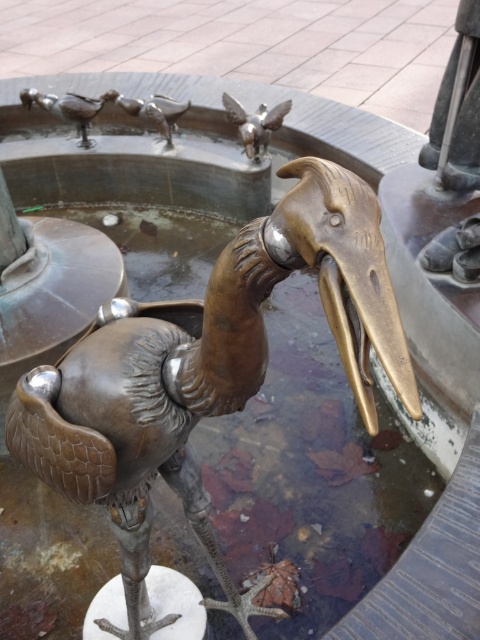
Question: Estimate the real-world distances between objects in this image. Which object is closer to the shiny silver birds at upper center?

Choices:
 (A) shiny silver birds at upper left
 (B) bronze statue at center
 (C) polished silver bird at center

Answer: (A)

Question: Where is polished silver bird at center located in relation to shiny silver birds at upper center in the image?

Choices:
 (A) below
 (B) above

Answer: (A)

Question: Is bronze statue at center further to the viewer compared to shiny silver birds at upper left?

Choices:
 (A) yes
 (B) no

Answer: (B)

Question: Which point is closer to the camera?

Choices:
 (A) (244, 134)
 (B) (90, 100)
 (C) (170, 136)

Answer: (A)

Question: Among these objects, which one is nearest to the camera?

Choices:
 (A) shiny silver birds at upper left
 (B) polished silver bird at center
 (C) bronze statue at center
 (D) shiny silver birds at upper center

Answer: (C)

Question: Can you confirm if shiny silver birds at upper left is wider than shiny silver birds at upper center?

Choices:
 (A) yes
 (B) no

Answer: (A)